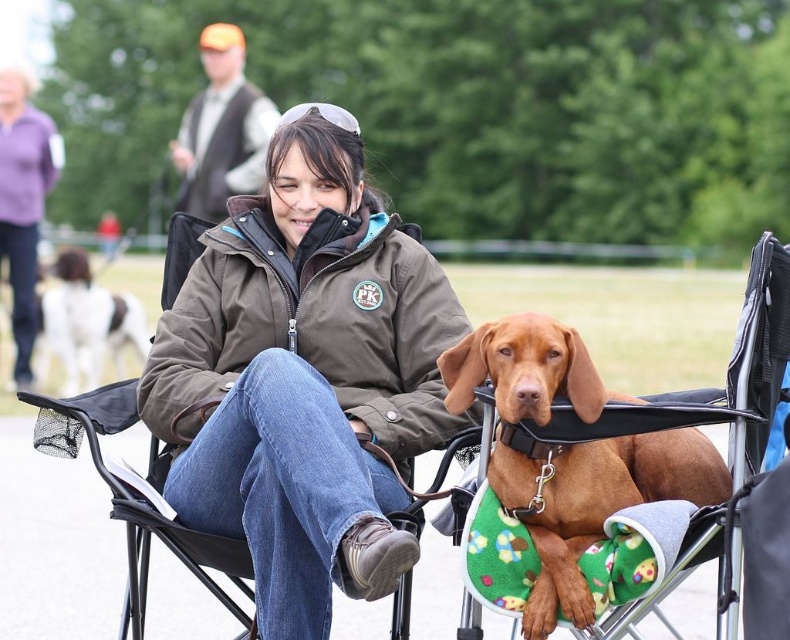
Looking at this image, you are a fashion designer observing the scene. You need to determine which item is shorter in height between the brown soft jacket at center and the orange fabric vest at upper left without measuring them. Based on the scene, which one is shorter?

The brown soft jacket at center is shorter in height compared to the orange fabric vest at upper left.

You are standing in the scene and want to walk from point A to point B. Point A is at coordinates point [28,90] and point B is at coordinates point [51,312]. Which direction should you move to get from point A to point B?

To move from point A to point B, you should move towards the right and slightly forward since point A is closer to the viewer than point B.